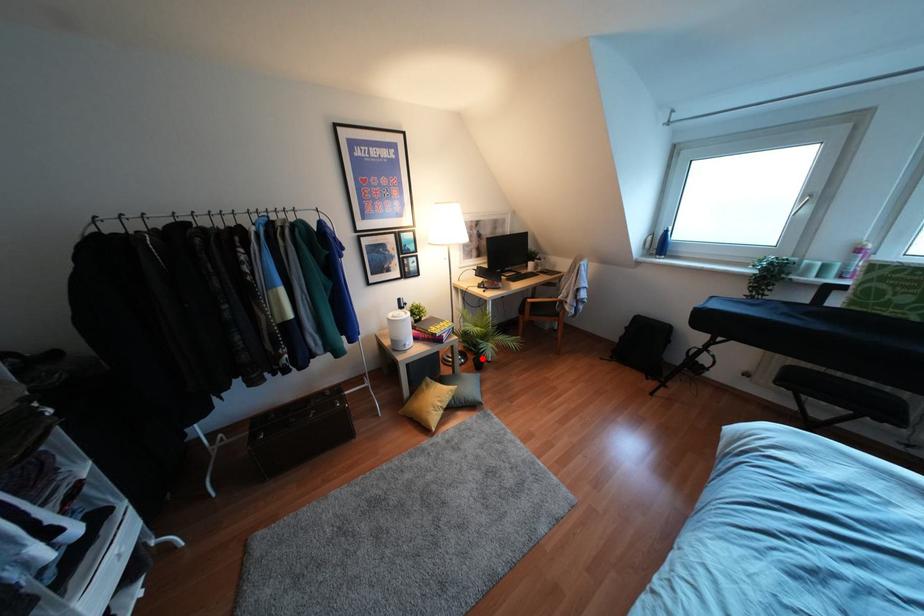
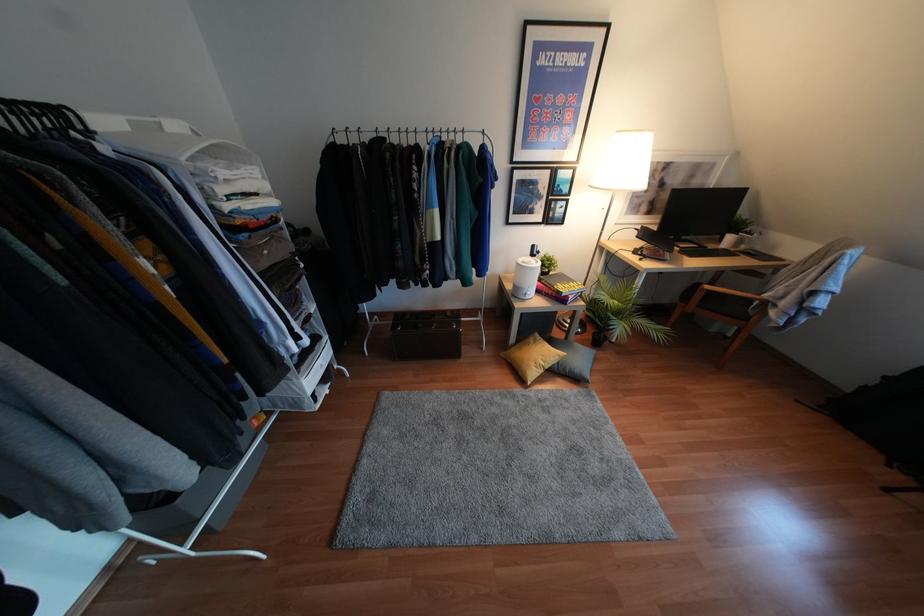
In the second image, find the point that corresponds to the highlighted location in the first image.

(604, 336)